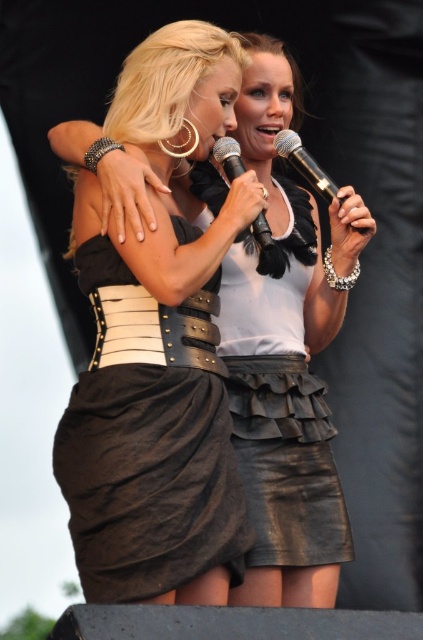
You are a photographer standing at the camera position. You want to adjust your focus to capture the brown leather skirt at center clearly. Considering the skirt is 12.09 meters away, what is the minimum focusing distance your camera lens must have to capture it sharply?

The brown leather skirt at center is 12.09 meters away from the camera, so the camera lens must have a minimum focusing distance of at least 12.09 meters to capture it sharply.